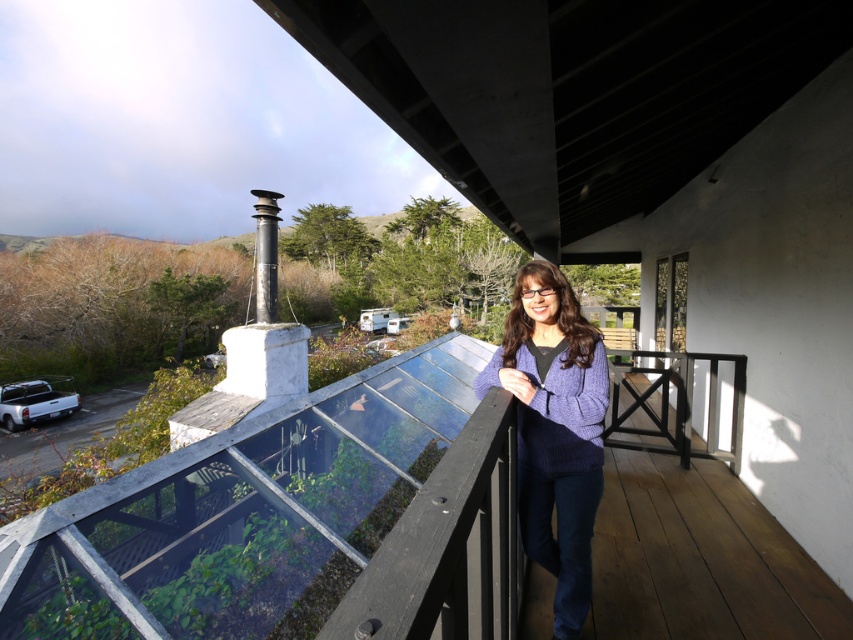
Who is shorter, wooden porch at center or wooden deck at center?

With less height is wooden deck at center.

Who is more distant from viewer, [479,436] or [630,451]?

The point [630,451] is behind.

Identify the location of wooden porch at center. The image size is (853, 640). (294, 522).

Is point (463, 550) more distant than point (592, 472)?

No, it is in front of (592, 472).

Is wooden porch at center to the right of purple knitted sweater at center from the viewer's perspective?

Incorrect, wooden porch at center is not on the right side of purple knitted sweater at center.

Between point (134, 515) and point (599, 477), which one is positioned in front?

Point (134, 515) is more forward.

At what (x,y) coordinates should I click in order to perform the action: click on wooden porch at center. Please return your answer as a coordinate pair (x, y). The image size is (853, 640). Looking at the image, I should click on (294, 522).

Is wooden deck at center above purple knitted sweater at center?

No, wooden deck at center is not above purple knitted sweater at center.

Does point (805, 589) come farther from viewer compared to point (535, 438)?

Yes.

At what (x,y) coordinates should I click in order to perform the action: click on wooden deck at center. Please return your answer as a coordinate pair (x, y). This screenshot has height=640, width=853. Looking at the image, I should click on (700, 560).